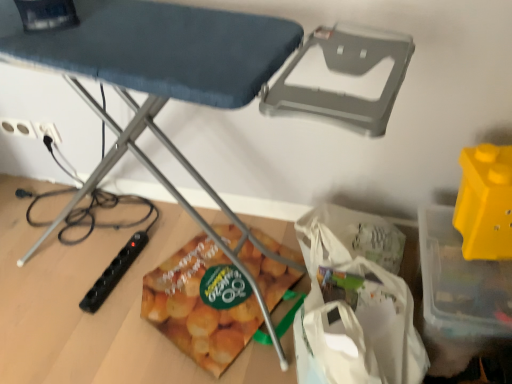
Question: Considering the relative positions of matte plastic snack bag at lower center and white plastic electric outlet at lower left, acting as the 2th electric outlet starting from the left, in the image provided, is matte plastic snack bag at lower center to the left or to the right of white plastic electric outlet at lower left, acting as the 2th electric outlet starting from the left,?

Choices:
 (A) right
 (B) left

Answer: (A)

Question: Is matte plastic snack bag at lower center bigger or smaller than white plastic electric outlet at lower left, acting as the 2th electric outlet starting from the left?

Choices:
 (A) big
 (B) small

Answer: (A)

Question: Based on their relative distances, which object is farther from the white fabric grocery bag at lower center?

Choices:
 (A) white plastic electric outlet at lower left, which appears as the first electric outlet when viewed from the right
 (B) yellow plastic storage box at right
 (C) metallic ironing board at center
 (D) yellow plastic toy at upper right, which is counted as the first toy, starting from the top
 (E) black plastic power strip at lower left, placed as the second toy when sorted from right to left

Answer: (A)

Question: Which object is the closest to the yellow plastic toy at upper right, the 2th toy in the bottom-to-top sequence?

Choices:
 (A) matte plastic snack bag at lower center
 (B) yellow plastic storage box at right
 (C) white plastic electric outlet at lower left, acting as the 2th electric outlet starting from the left
 (D) white fabric grocery bag at lower center
 (E) white plastic electric outlet at upper left, positioned as the 2th electric outlet in right-to-left order

Answer: (B)